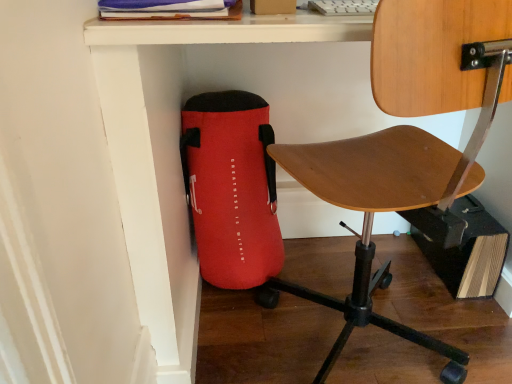
The width and height of the screenshot is (512, 384). Find the location of `free area in between wooden seat at center and red fabric bag at lower left`. free area in between wooden seat at center and red fabric bag at lower left is located at coordinates (293, 297).